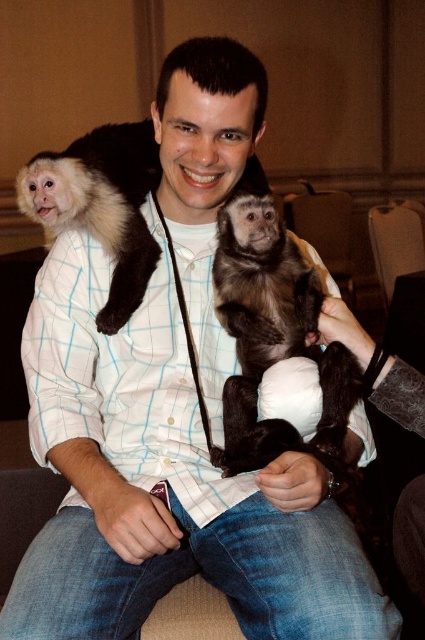
You are a photographer trying to capture both monkeys in the scene. Since the brown furry monkey at center is smaller than the dark brown fur monkey at upper left, which monkey should you move closer to the camera to make them appear the same size in the photo?

To make them appear the same size in the photo, you should move the brown furry monkey at center closer to the camera since it is smaller than the dark brown fur monkey at upper left.

You are a photographer trying to capture a candid shot of the brown furry monkey at center and the brown leather armchair at upper center. Since you want to highlight the monkey, which object should you focus on first, considering their sizes?

The brown furry monkey at center is thinner than the brown leather armchair at upper center, so you should focus on the brown furry monkey at center first as it is smaller and requires precise focus.

You are a photographer who needs to decide which monkey to focus on for a closeup shot. Since the brown furry monkey at center is thinner than the dark brown fur monkey at upper left, which monkey would you choose to ensure the subject fits entirely within the camera frame?

The brown furry monkey at center is thinner than the dark brown fur monkey at upper left, so choosing the brown furry monkey at center would ensure the subject fits entirely within the camera frame.